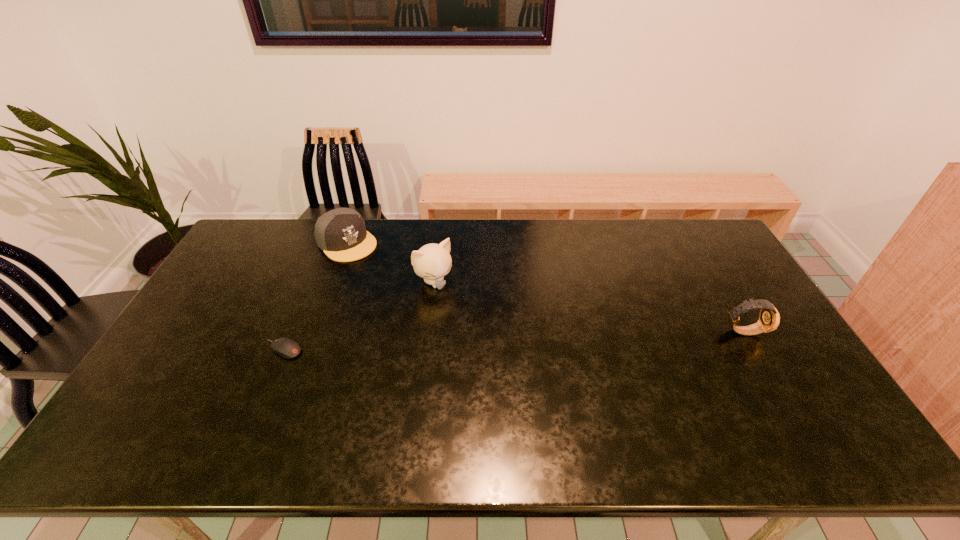
Image resolution: width=960 pixels, height=540 pixels. What are the coordinates of `the shortest object` in the screenshot? It's located at (286, 348).

Where is `the rightmost object`? The height and width of the screenshot is (540, 960). the rightmost object is located at coordinates (769, 319).

Identify the location of the tallest object. (432, 262).

The width and height of the screenshot is (960, 540). I want to click on the third nearest object, so click(x=432, y=262).

This screenshot has width=960, height=540. What are the coordinates of `the farthest object` in the screenshot? It's located at (341, 233).

Identify the location of vacant region located on the right of the shortest object. Image resolution: width=960 pixels, height=540 pixels. (363, 350).

At what (x,y) coordinates should I click in order to perform the action: click on vacant space located 0.050m on the face of the rightmost object. Please return your answer as a coordinate pair (x, y). Looking at the image, I should click on (780, 331).

The width and height of the screenshot is (960, 540). I want to click on vacant area situated on the face of the kitten, so click(507, 369).

Find the location of a particular element. Image resolution: width=960 pixels, height=540 pixels. free spot located 0.210m on the face of the kitten is located at coordinates (479, 335).

Find the location of a particular element. vacant space located on the face of the kitten is located at coordinates (491, 349).